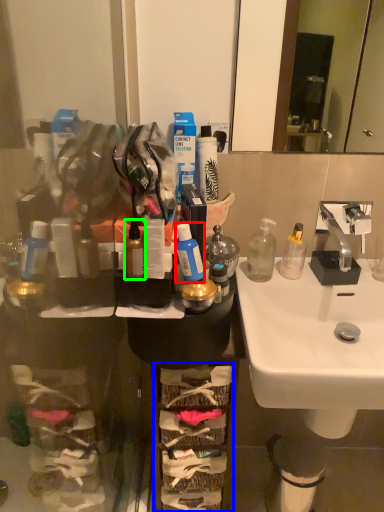
Question: Which object is the farthest from mouthwash (highlighted by a red box)? Choose among these: shelf (highlighted by a blue box) or bottle (highlighted by a green box).

Choices:
 (A) shelf
 (B) bottle

Answer: (A)